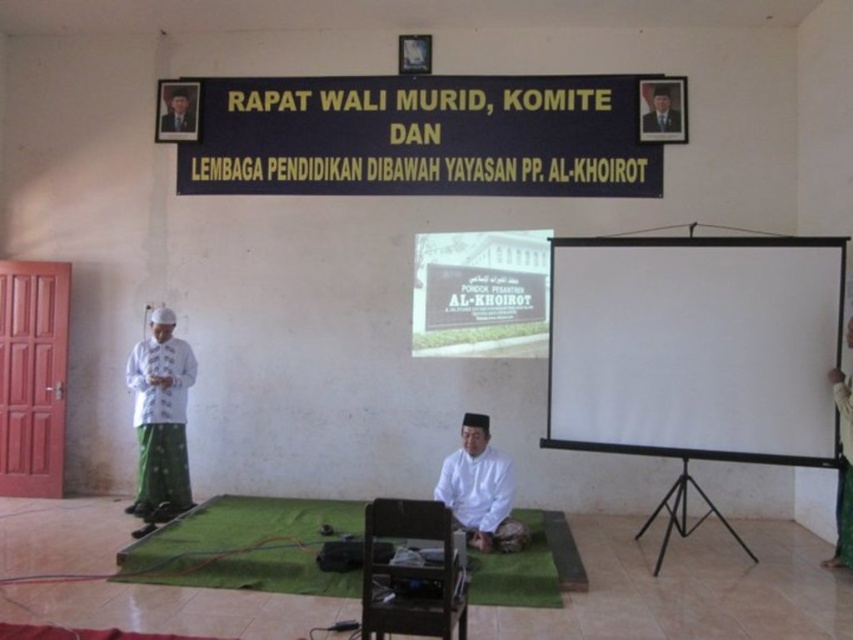
You are organizing a photography event and need to ensure that all items in the frame are visible. Given that the white matte shirt at center and the matte black photo frame at upper left are both in the camera view, which object would require more focus adjustment due to its size?

The white matte shirt at center is bigger than the matte black photo frame at upper left, so it would require more focus adjustment due to its larger size.

You are attending a meeting and need to present a slide. You see a white matte projection screen at right and a green fabric at right. Which one is closer to you?

The white matte projection screen at right is closer to you because it is further to the viewer than the green fabric at right.

You are standing at the entrance of the room and want to reach the green carpet at center. Which direction should you walk towards?

Since the green carpet at center is located at coordinates point (242, 525), you should walk towards the center of the room to reach it.